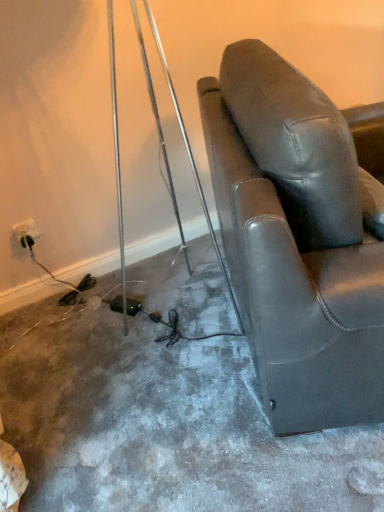
Question: Do you think matte black leather chair at right is within white plastic outlet at lower left, or outside of it?

Choices:
 (A) outside
 (B) inside

Answer: (A)

Question: In terms of width, does matte black leather chair at right look wider or thinner when compared to white plastic outlet at lower left?

Choices:
 (A) wide
 (B) thin

Answer: (A)

Question: From the image's perspective, is matte black leather chair at right above or below white plastic outlet at lower left?

Choices:
 (A) below
 (B) above

Answer: (B)

Question: From the image's perspective, is white plastic outlet at lower left above or below matte black leather chair at right?

Choices:
 (A) above
 (B) below

Answer: (B)

Question: Is white plastic outlet at lower left wider or thinner than matte black leather chair at right?

Choices:
 (A) wide
 (B) thin

Answer: (B)

Question: Relative to matte black leather chair at right, is white plastic outlet at lower left in front or behind?

Choices:
 (A) front
 (B) behind

Answer: (B)

Question: From a real-world perspective, relative to matte black leather chair at right, is white plastic outlet at lower left vertically above or below?

Choices:
 (A) above
 (B) below

Answer: (B)